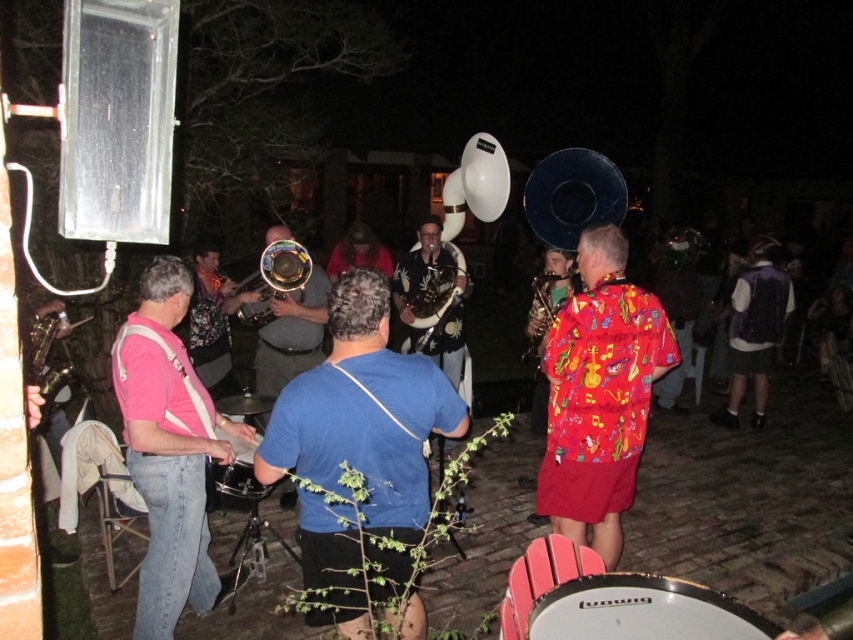
Question: Does pink fabric shirt at left appear over white drumhead at lower center?

Choices:
 (A) yes
 (B) no

Answer: (A)

Question: Does blue cotton shirt at center have a larger size compared to red cotton shirt at center?

Choices:
 (A) no
 (B) yes

Answer: (A)

Question: Estimate the real-world distances between objects in this image. Which object is closer to the black drum at center?

Choices:
 (A) shiny gold saxophone at center
 (B) red cotton shirt at center
 (C) pink fabric shirt at left

Answer: (C)

Question: Which object is positioned closest to the black drum at center?

Choices:
 (A) gold brass trumpet at center
 (B) white drumhead at lower center
 (C) pink fabric shirt at left
 (D) shiny gold saxophone at center

Answer: (C)

Question: Where is shiny brass tuba at center located in relation to black drum at center in the image?

Choices:
 (A) right
 (B) left

Answer: (B)

Question: Which object is farther from the camera taking this photo?

Choices:
 (A) blue cotton shirt at center
 (B) pink fabric shirt at left
 (C) shiny brass tuba at center
 (D) shiny gold saxophone at center

Answer: (C)